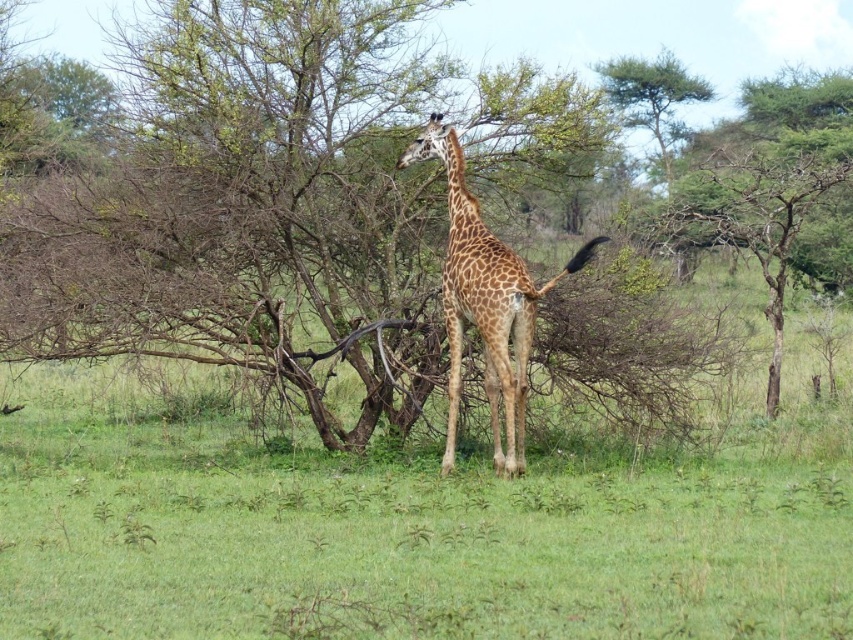
Is point (653, 410) less distant than point (651, 81)?

Yes, point (653, 410) is closer to viewer.

Between point (456, 70) and point (648, 109), which one is positioned behind?

Positioned behind is point (648, 109).

Locate an element on the screen. This screenshot has width=853, height=640. brown leafless tree at center is located at coordinates (248, 205).

Between brown leafless tree at center and spotted fur giraffe at center, which one has more height?

Standing taller between the two is brown leafless tree at center.

From the picture: Is brown leafless tree at center below spotted fur giraffe at center?

No, brown leafless tree at center is not below spotted fur giraffe at center.

Between point (112, 348) and point (498, 376), which one is positioned in front?

Point (498, 376) is in front.

Image resolution: width=853 pixels, height=640 pixels. What are the coordinates of `brown leafless tree at center` in the screenshot? It's located at (248, 205).

Between spotted fur giraffe at center and green leafy tree at upper center, which one is positioned lower?

spotted fur giraffe at center is lower down.

Can you confirm if spotted fur giraffe at center is positioned above green leafy tree at upper center?

Actually, spotted fur giraffe at center is below green leafy tree at upper center.

I want to click on spotted fur giraffe at center, so click(x=485, y=300).

I want to click on spotted fur giraffe at center, so click(x=485, y=300).